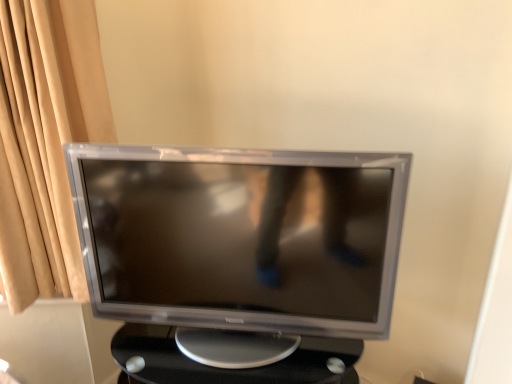
I want to click on empty space that is ontop of black plastic table at center (from a real-world perspective), so click(x=229, y=347).